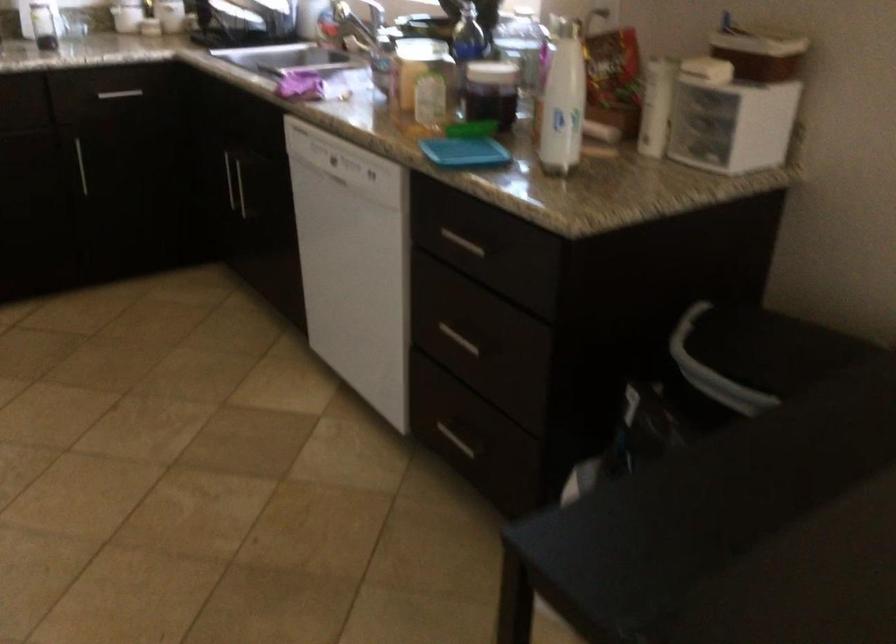
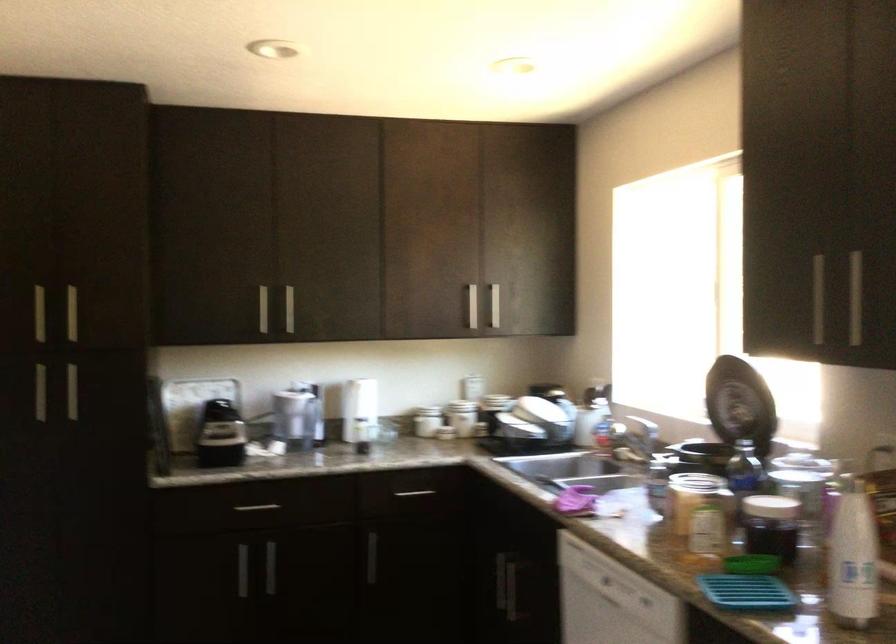
Locate, in the second image, the point that corresponds to pixel 488 96 in the first image.

(771, 526)